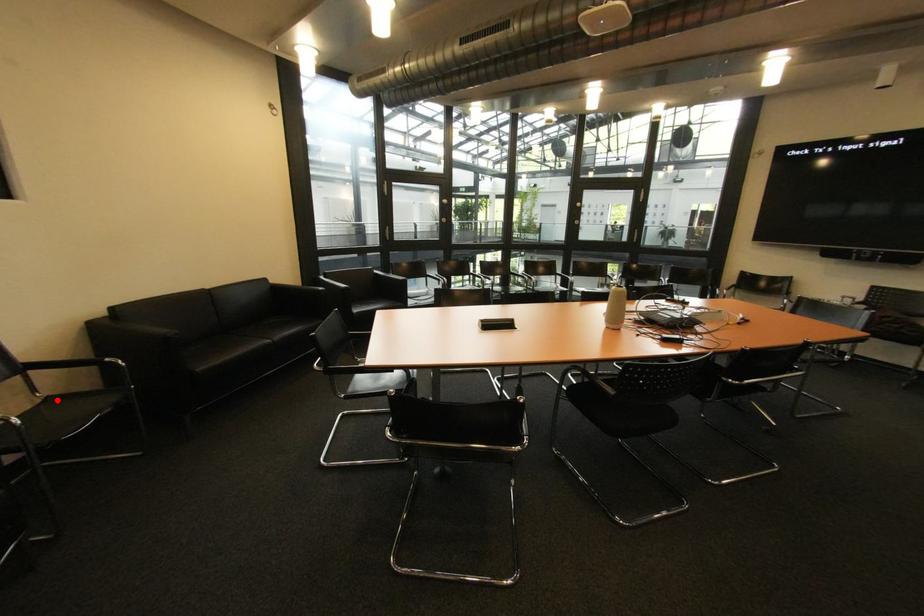
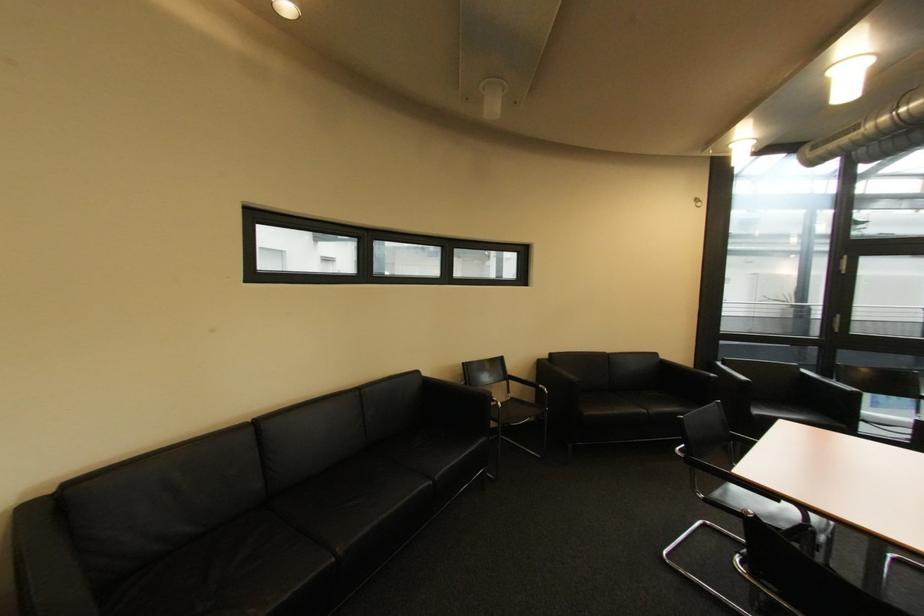
The point at the highlighted location is marked in the first image. Where is the corresponding point in the second image?

(520, 400)